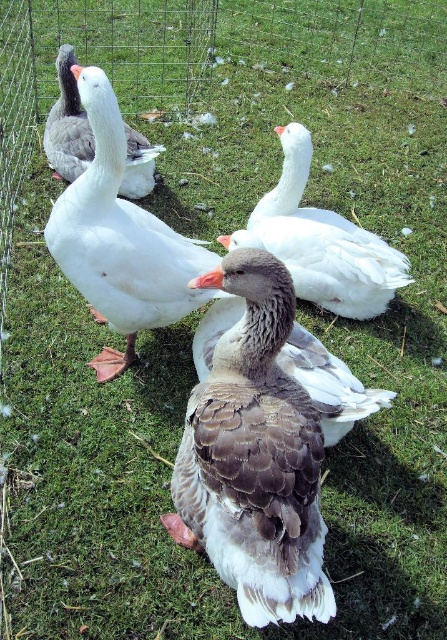
You are a farmer checking the enclosure for the white matte duck at center and the gray matte goose at upper left. You need to ensure there is enough space between them to prevent overcrowding. Based on their sizes, which one requires a wider space?

The gray matte goose at upper left requires a wider space because its width is greater than the white matte duck at center.